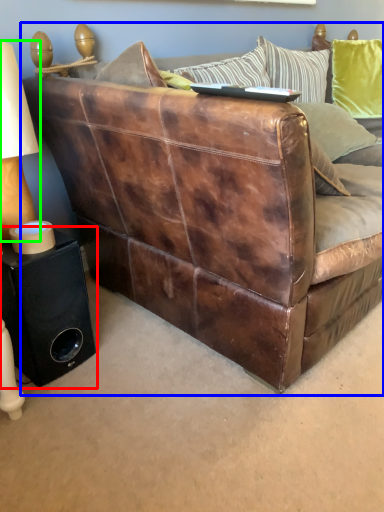
Question: Which is nearer to the speaker (highlighted by a red box)? studio couch (highlighted by a blue box) or table lamp (highlighted by a green box).

Choices:
 (A) studio couch
 (B) table lamp

Answer: (B)